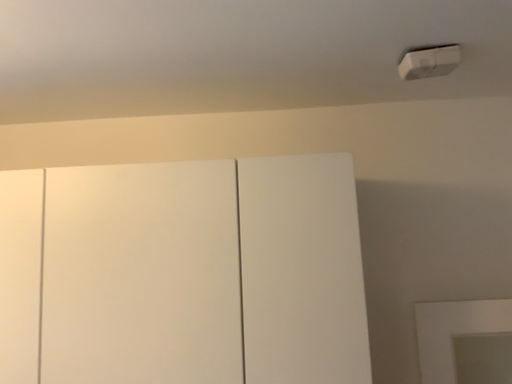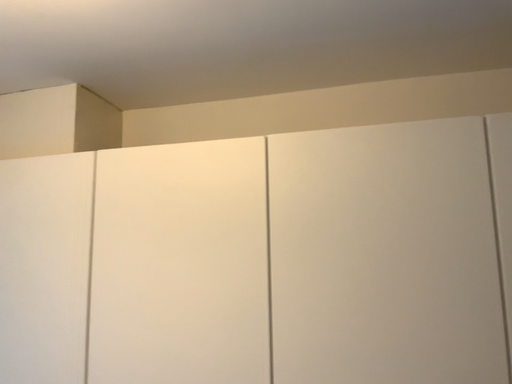
Question: Which way did the camera rotate in the video?

Choices:
 (A) rotated left
 (B) rotated right

Answer: (A)